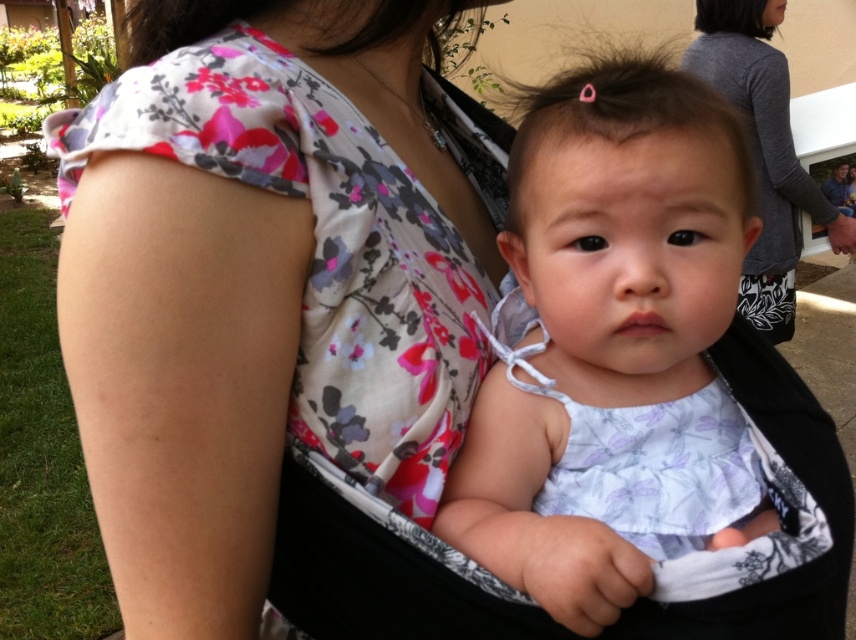
Question: Can you confirm if white floral dress at center is positioned below gray matte shirt at upper right?

Choices:
 (A) yes
 (B) no

Answer: (A)

Question: Which of the following is the farthest from the observer?

Choices:
 (A) white floral dress at center
 (B) gray matte shirt at upper right

Answer: (B)

Question: Is white floral dress at center to the left of gray matte shirt at upper right from the viewer's perspective?

Choices:
 (A) no
 (B) yes

Answer: (B)

Question: Does white floral dress at center appear on the left side of gray matte shirt at upper right?

Choices:
 (A) yes
 (B) no

Answer: (A)